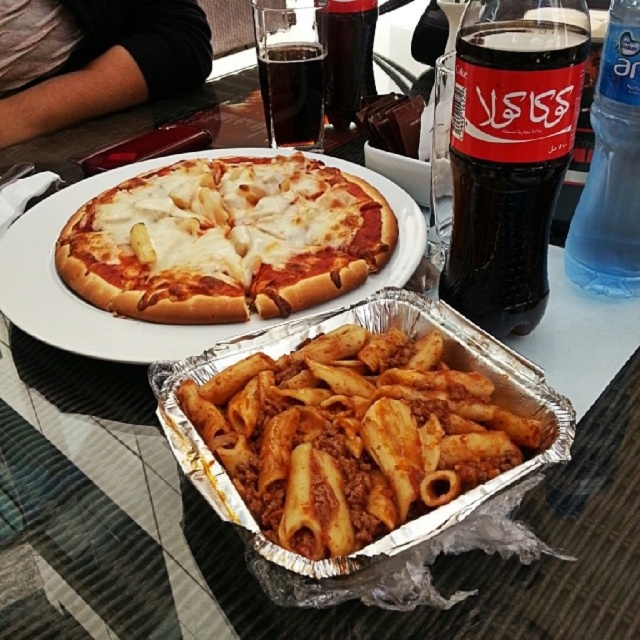
Question: Estimate the real-world distances between objects in this image. Which object is closer to the gray fabric shirt at upper left?

Choices:
 (A) matte yellow pasta at center
 (B) dark glass soda at upper center
 (C) dark glass coca-cola at upper right

Answer: (B)

Question: Among these objects, which one is farthest from the camera?

Choices:
 (A) dark glass coca-cola at upper right
 (B) matte yellow pasta at center
 (C) dark glass soda at upper center

Answer: (C)

Question: Does dark glass coca-cola at upper right lie behind gray fabric shirt at upper left?

Choices:
 (A) no
 (B) yes

Answer: (A)

Question: Does matte yellow pasta at center have a greater width compared to white cheese pizza at center?

Choices:
 (A) no
 (B) yes

Answer: (A)

Question: Which object appears closest to the camera in this image?

Choices:
 (A) dark glass coca-cola at upper right
 (B) blue plastic bottle at upper right
 (C) gray fabric shirt at upper left
 (D) dark glass soda at upper center

Answer: (A)

Question: Does matte yellow pasta at center appear over white cheese pizza at center?

Choices:
 (A) yes
 (B) no

Answer: (B)